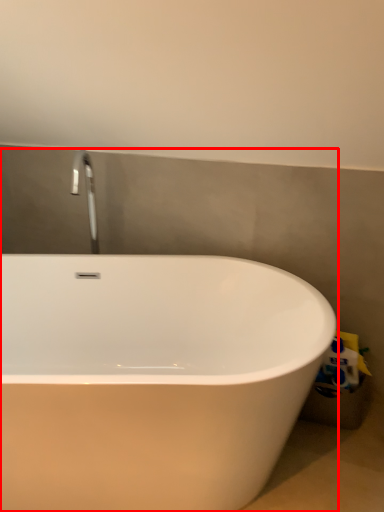
Question: Considering the relative positions of bathtub (annotated by the red box) and toilet paper in the image provided, where is bathtub (annotated by the red box) located with respect to the staircase?

Choices:
 (A) right
 (B) left

Answer: (B)